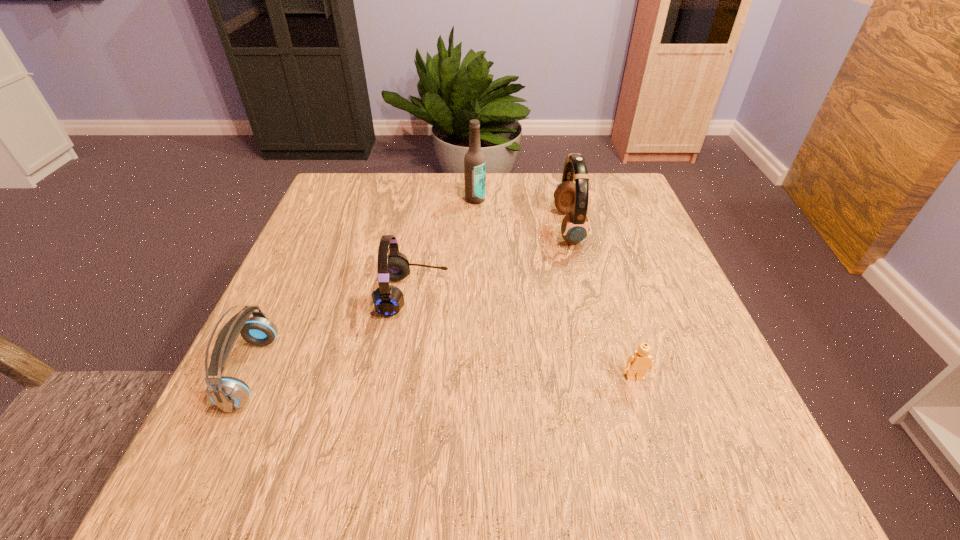
Locate an element on the screen. The height and width of the screenshot is (540, 960). vacant region between the leftmost headset and the rightmost headset is located at coordinates (410, 300).

You are a GUI agent. You are given a task and a screenshot of the screen. Output one action in this format:
    pyautogui.click(x=<x>, y=<y>)
    Task: Click on the free point between the beer bottle and the fourth object from right to left
    This screenshot has width=960, height=540.
    Given the screenshot: What is the action you would take?
    pyautogui.click(x=444, y=247)

You are a GUI agent. You are given a task and a screenshot of the screen. Output one action in this format:
    pyautogui.click(x=<x>, y=<y>)
    Task: Click on the vacant area that lies between the rightmost headset and the beer bottle
    The image size is (960, 540).
    Given the screenshot: What is the action you would take?
    pyautogui.click(x=521, y=213)

Identify the location of free space that is in between the third object from left to right and the third nearest object. The image size is (960, 540). (444, 247).

At what (x,y) coordinates should I click in order to perform the action: click on free space between the leftmost headset and the farthest headset. Please return your answer as a coordinate pair (x, y). Looking at the image, I should click on (410, 300).

Where is `free area in between the third farthest object and the leftmost object`? This screenshot has height=540, width=960. free area in between the third farthest object and the leftmost object is located at coordinates click(332, 333).

You are a GUI agent. You are given a task and a screenshot of the screen. Output one action in this format:
    pyautogui.click(x=<x>, y=<y>)
    Task: Click on the free spot between the nearest headset and the third object from left to right
    Image resolution: width=960 pixels, height=540 pixels.
    Given the screenshot: What is the action you would take?
    [x=363, y=286]

This screenshot has height=540, width=960. Find the location of `object that is the second nearest to the nearest headset`. object that is the second nearest to the nearest headset is located at coordinates (474, 161).

Locate which object is the third closest to the farthest object. Please provide its 2D coordinates. Your answer should be formatted as a tuple, i.e. [(x, y)], where the tuple contains the x and y coordinates of a point satisfying the conditions above.

[(228, 393)]

Locate an element on the screen. headset that can be found as the second closest to the leftmost object is located at coordinates (571, 198).